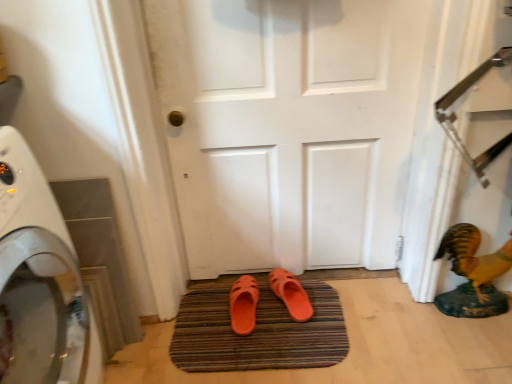
In order to click on free space to the left of shiny gold statue at lower right in this screenshot , I will do `click(411, 319)`.